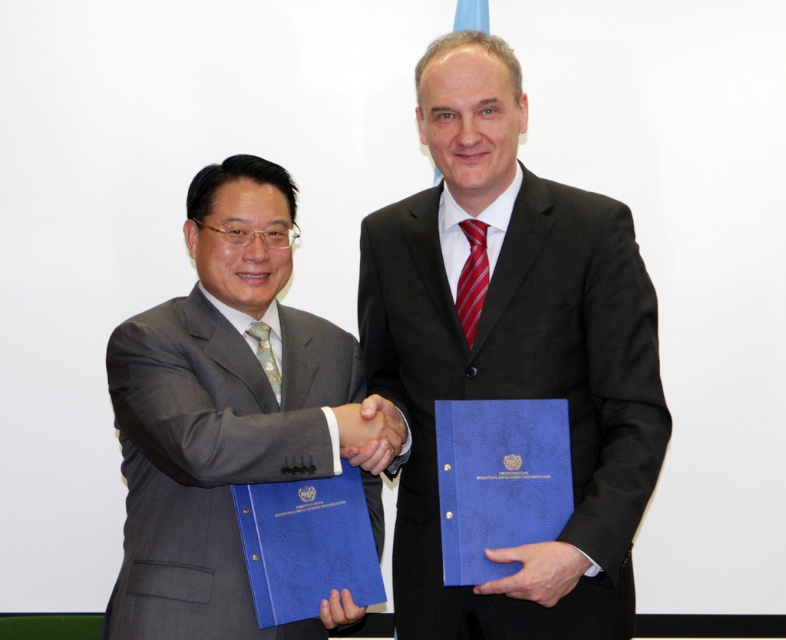
Who is taller, matte gray suit at left or red striped tie at center?

Standing taller between the two is matte gray suit at left.

Is matte gray suit at left positioned behind red striped tie at center?

No, matte gray suit at left is closer to the viewer.

Which is behind, point (145, 508) or point (461, 332)?

The point (461, 332) is more distant.

At what (x,y) coordinates should I click in order to perform the action: click on matte gray suit at left. Please return your answer as a coordinate pair (x, y). Looking at the image, I should click on (219, 412).

Can you confirm if black matte suit at center is wider than matte gray suit at left?

Indeed, black matte suit at center has a greater width compared to matte gray suit at left.

Between black matte suit at center and matte gray suit at left, which one has less height?

With less height is matte gray suit at left.

Who is more distant from viewer, (406, 224) or (217, 573)?

Point (406, 224)

This screenshot has width=786, height=640. What are the coordinates of `black matte suit at center` in the screenshot? It's located at (511, 346).

Looking at this image, can you confirm if matte black hand at center is positioned to the right of red striped tie at center?

Incorrect, matte black hand at center is not on the right side of red striped tie at center.

Who is taller, matte black hand at center or red striped tie at center?

red striped tie at center

Is point (399, 417) closer to camera compared to point (483, 256)?

Yes, it is in front of point (483, 256).

Locate an element on the screen. matte black hand at center is located at coordinates (369, 433).